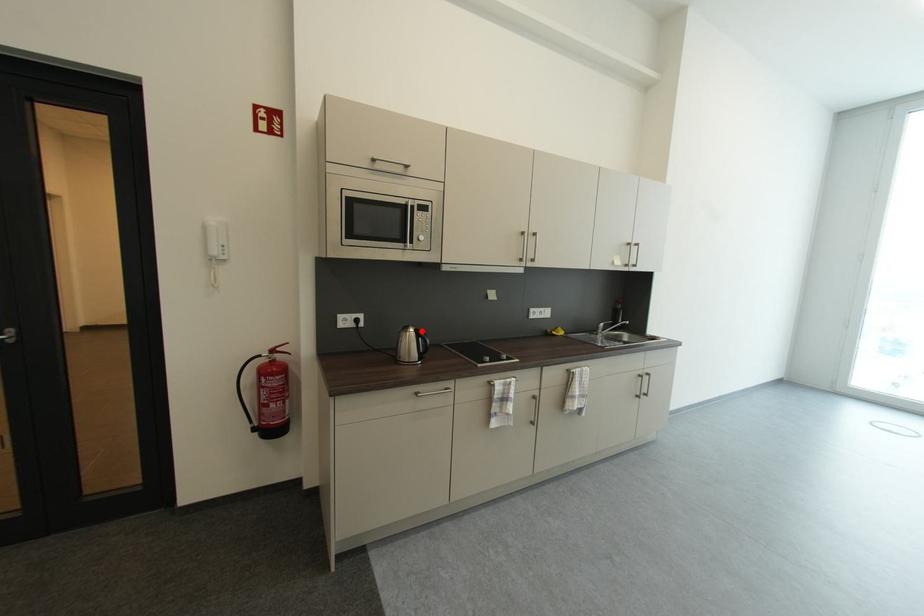
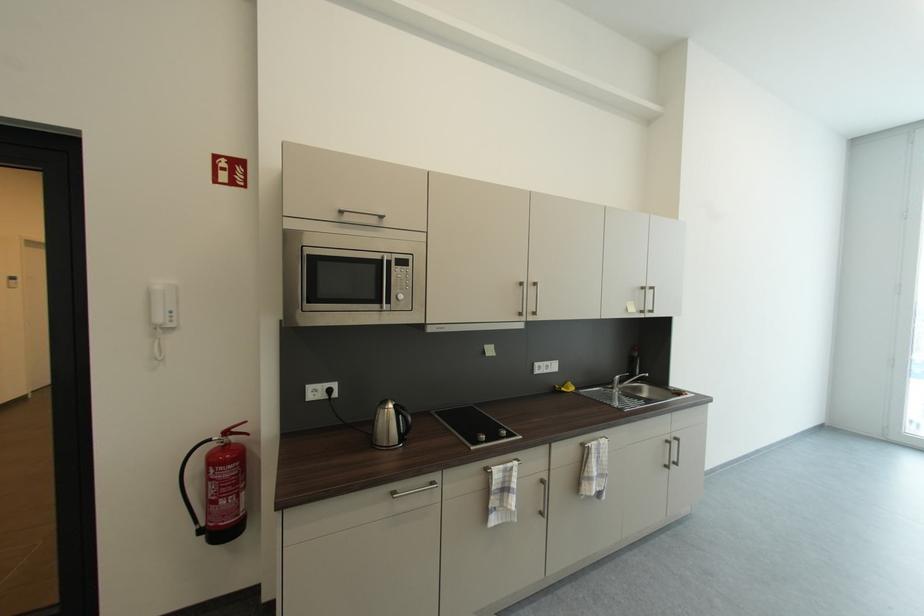
Where in the second image is the point corresponding to the highlighted location from the first image?

(400, 407)